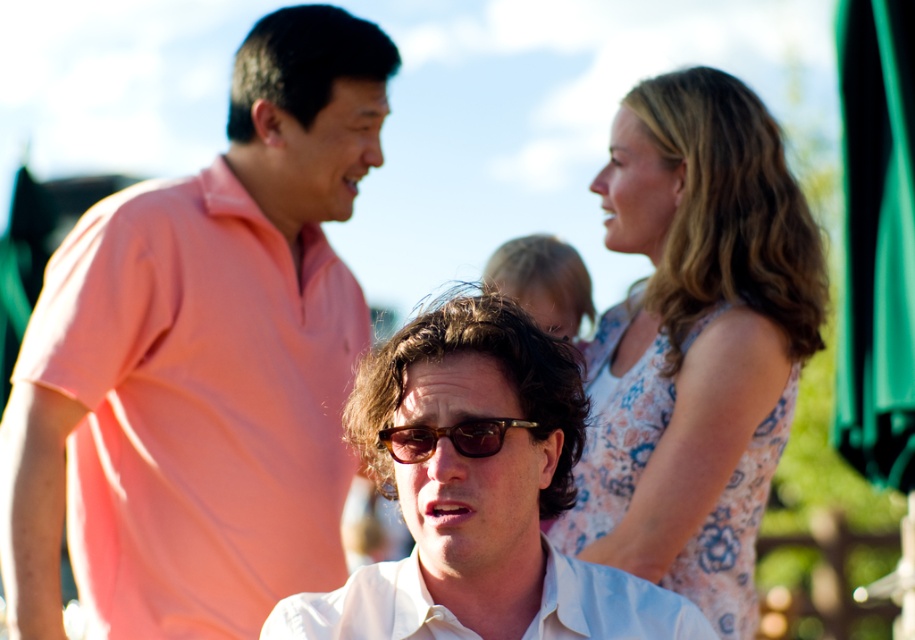
From the picture: Which is above, matte white shirt at center or brown tortoiseshell sunglasses at center?

brown tortoiseshell sunglasses at center is higher up.

Which is below, matte white shirt at center or brown tortoiseshell sunglasses at center?

matte white shirt at center is lower down.

This screenshot has width=915, height=640. Find the location of `matte white shirt at center`. matte white shirt at center is located at coordinates (478, 493).

Does point (580, 573) lie in front of point (496, 262)?

Yes, point (580, 573) is in front of point (496, 262).

Can you confirm if white cotton shirt at center is bigger than blonde hair at center?

Actually, white cotton shirt at center might be smaller than blonde hair at center.

Locate an element on the screen. white cotton shirt at center is located at coordinates (608, 604).

Which of these two, floral dress at upper right or white cotton shirt at center, stands taller?

Standing taller between the two is floral dress at upper right.

Is floral dress at upper right wider than white cotton shirt at center?

Incorrect, floral dress at upper right's width does not surpass white cotton shirt at center's.

This screenshot has height=640, width=915. In order to click on floral dress at upper right in this screenshot , I will do `click(695, 342)`.